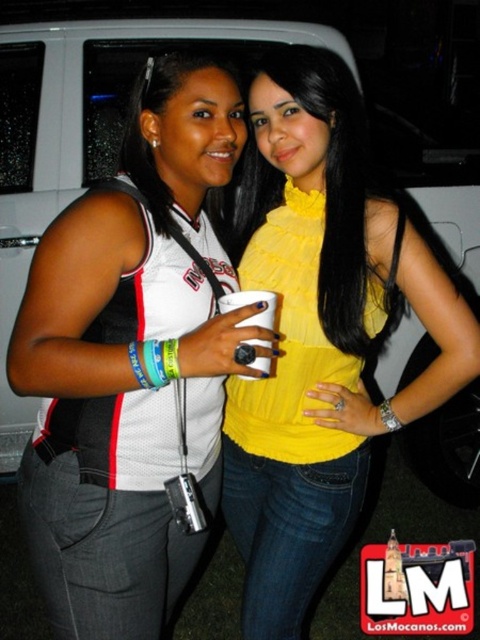
Question: Can you confirm if yellow satin blouse at center is positioned to the left of white paper cup at center?

Choices:
 (A) no
 (B) yes

Answer: (A)

Question: Is white jersey at center closer to the viewer compared to yellow satin blouse at center?

Choices:
 (A) no
 (B) yes

Answer: (B)

Question: Which object is the farthest from the white jersey at center?

Choices:
 (A) yellow satin blouse at center
 (B) white paper cup at center

Answer: (B)

Question: Which point is closer to the camera?

Choices:
 (A) (265, 307)
 (B) (280, 499)

Answer: (A)

Question: Estimate the real-world distances between objects in this image. Which object is closer to the white jersey at center?

Choices:
 (A) yellow satin blouse at center
 (B) white paper cup at center

Answer: (A)

Question: Is white jersey at center further to the viewer compared to yellow satin blouse at center?

Choices:
 (A) yes
 (B) no

Answer: (B)